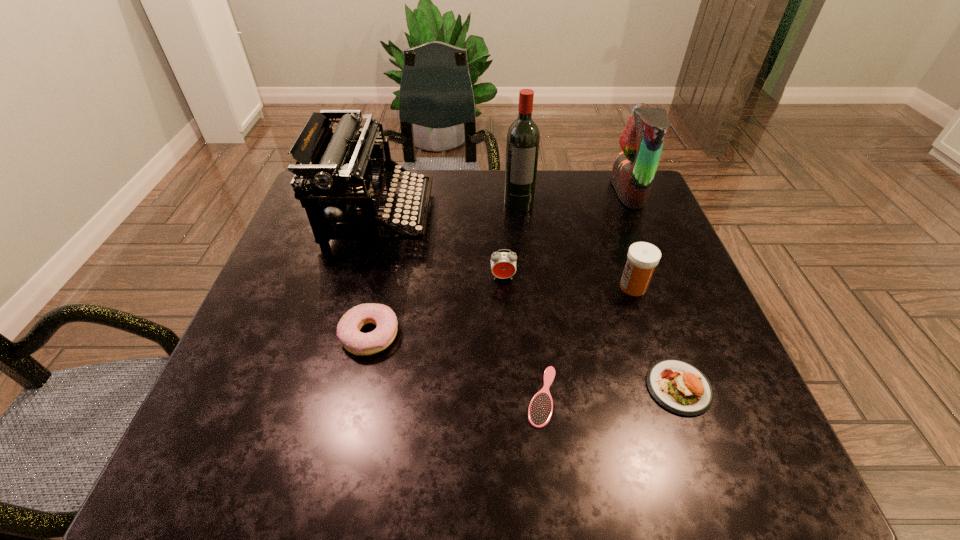
Identify the location of vacant region located 0.080m at the face of the parrot. The height and width of the screenshot is (540, 960). (586, 192).

In order to click on free space located 0.340m at the face of the parrot in this screenshot , I will do `click(493, 192)`.

Identify the location of free space located on the typing side of the typewriter. (550, 216).

Where is `free region located on the back of the medicine`? free region located on the back of the medicine is located at coordinates (598, 185).

Find the location of a particular element. This screenshot has height=540, width=960. vacant space positioned on the face of the fourth shortest object is located at coordinates (506, 332).

I want to click on blank area located on the right of the third nearest object, so click(x=537, y=335).

Identify the location of vacant space located on the left of the second shortest object. The image size is (960, 540). (576, 388).

Identify the location of vacant point located 0.080m on the right of the hairbrush. The image size is (960, 540). (603, 396).

This screenshot has width=960, height=540. I want to click on wine bottle that is at the far edge, so click(x=523, y=138).

At what (x,y) coordinates should I click in order to perform the action: click on parrot that is positioned at the far edge. Please return your answer as a coordinate pair (x, y). Image resolution: width=960 pixels, height=540 pixels. Looking at the image, I should click on (642, 140).